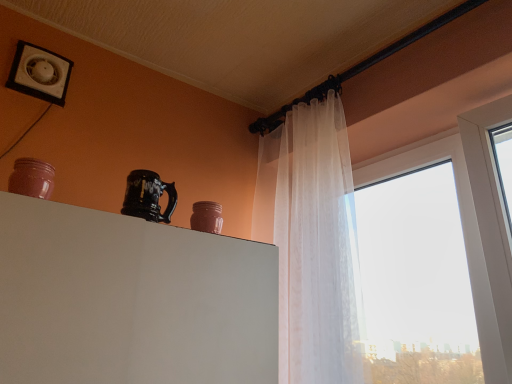
Question: Does matte pink jar at upper center, which appears as the first pottery when viewed from the back, contain glossy ceramic mug at upper center?

Choices:
 (A) no
 (B) yes

Answer: (A)

Question: Is matte pink jar at upper center, the first pottery from the right, positioned before glossy ceramic mug at upper center?

Choices:
 (A) no
 (B) yes

Answer: (A)

Question: Considering the relative positions of matte pink jar at upper center, the 2th pottery viewed from the top, and glossy ceramic mug at upper center in the image provided, is matte pink jar at upper center, the 2th pottery viewed from the top, to the left of glossy ceramic mug at upper center from the viewer's perspective?

Choices:
 (A) no
 (B) yes

Answer: (A)

Question: Is matte pink jar at upper center, which is the 2th pottery in left-to-right order, outside of glossy ceramic mug at upper center?

Choices:
 (A) yes
 (B) no

Answer: (A)

Question: Does matte pink jar at upper center, which appears as the first pottery when viewed from the back, have a greater height compared to glossy ceramic mug at upper center?

Choices:
 (A) no
 (B) yes

Answer: (A)

Question: From the image's perspective, is matte pink jar at upper center, which appears as the first pottery when viewed from the back, positioned above or below white plastic vent at upper left?

Choices:
 (A) above
 (B) below

Answer: (B)

Question: From a real-world perspective, is matte pink jar at upper center, which is the 2th pottery in left-to-right order, positioned above or below white plastic vent at upper left?

Choices:
 (A) above
 (B) below

Answer: (B)

Question: Choose the correct answer: Is matte pink jar at upper center, positioned as the second pottery in front-to-back order, inside white plastic vent at upper left or outside it?

Choices:
 (A) outside
 (B) inside

Answer: (A)

Question: In terms of height, does matte pink jar at upper center, the first pottery positioned from the bottom, look taller or shorter compared to white plastic vent at upper left?

Choices:
 (A) tall
 (B) short

Answer: (B)

Question: In terms of width, does white plastic vent at upper left look wider or thinner when compared to matte pink jar at upper center, which appears as the first pottery when viewed from the back?

Choices:
 (A) thin
 (B) wide

Answer: (A)

Question: Considering the relative positions of white plastic vent at upper left and matte pink jar at upper center, the first pottery positioned from the bottom, in the image provided, is white plastic vent at upper left to the left or to the right of matte pink jar at upper center, the first pottery positioned from the bottom,?

Choices:
 (A) right
 (B) left

Answer: (B)

Question: From a real-world perspective, is white plastic vent at upper left above or below matte pink jar at upper center, the first pottery from the right?

Choices:
 (A) below
 (B) above

Answer: (B)

Question: Is point (56, 104) positioned closer to the camera than point (208, 226)?

Choices:
 (A) closer
 (B) farther

Answer: (B)

Question: From their relative heights in the image, would you say glossy ceramic mug at upper center is taller or shorter than matte pink jar at left, which is the first pottery in left-to-right order?

Choices:
 (A) tall
 (B) short

Answer: (A)

Question: In terms of size, does glossy ceramic mug at upper center appear bigger or smaller than matte pink jar at left, positioned as the second pottery in right-to-left order?

Choices:
 (A) small
 (B) big

Answer: (B)